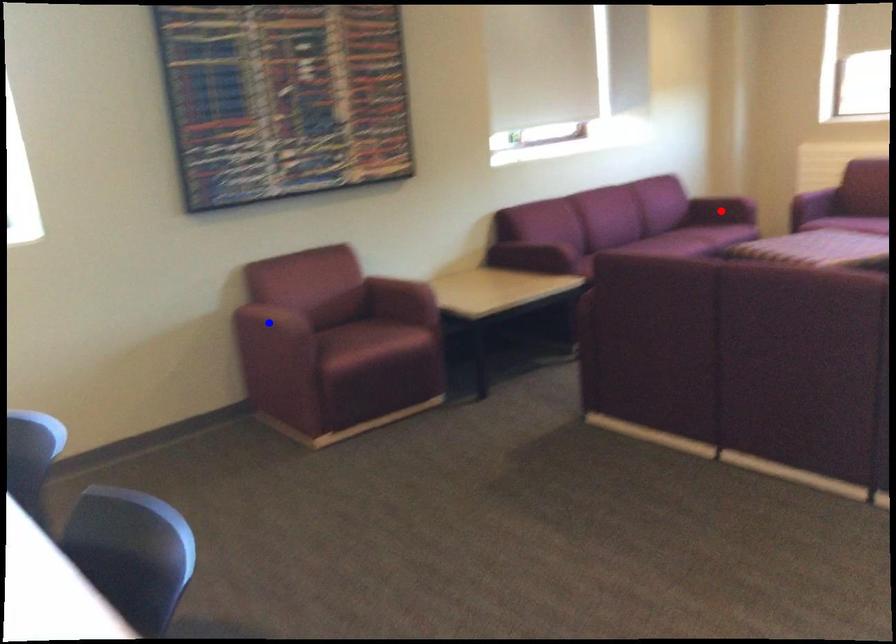
Question: Two points are marked on the image. Which point is closer to the camera?

Choices:
 (A) Blue point is closer.
 (B) Red point is closer.

Answer: (A)